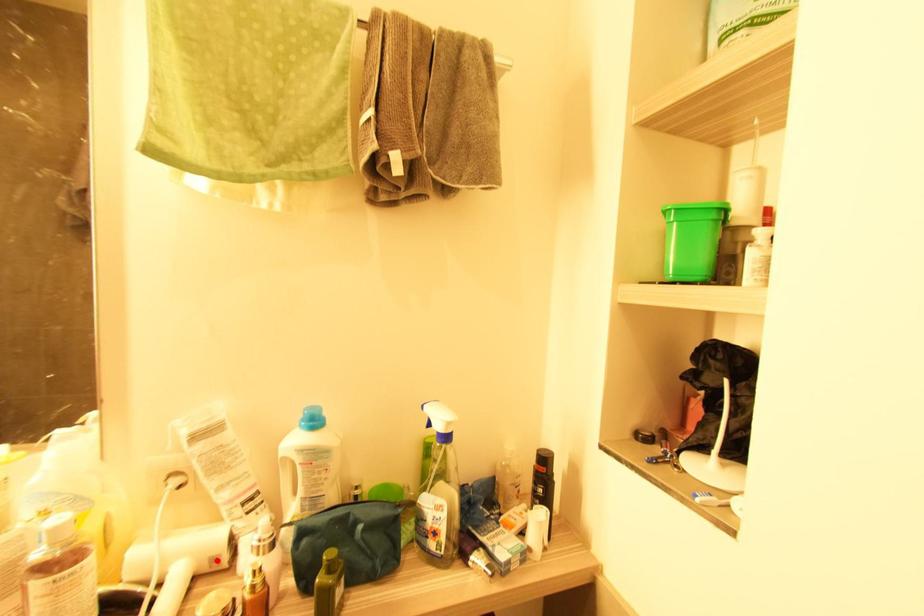
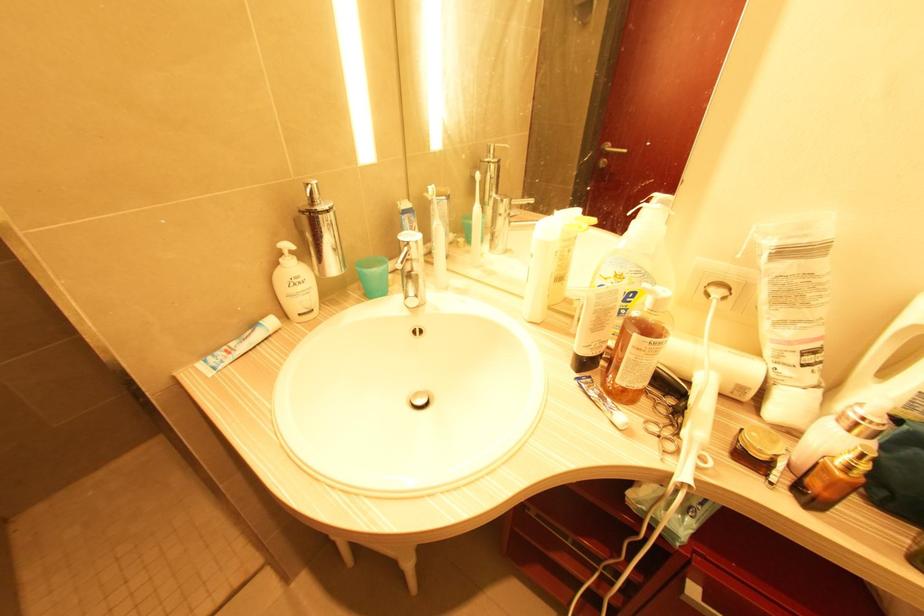
In the second image, find the point that corresponds to the highlighted location in the first image.

(743, 390)